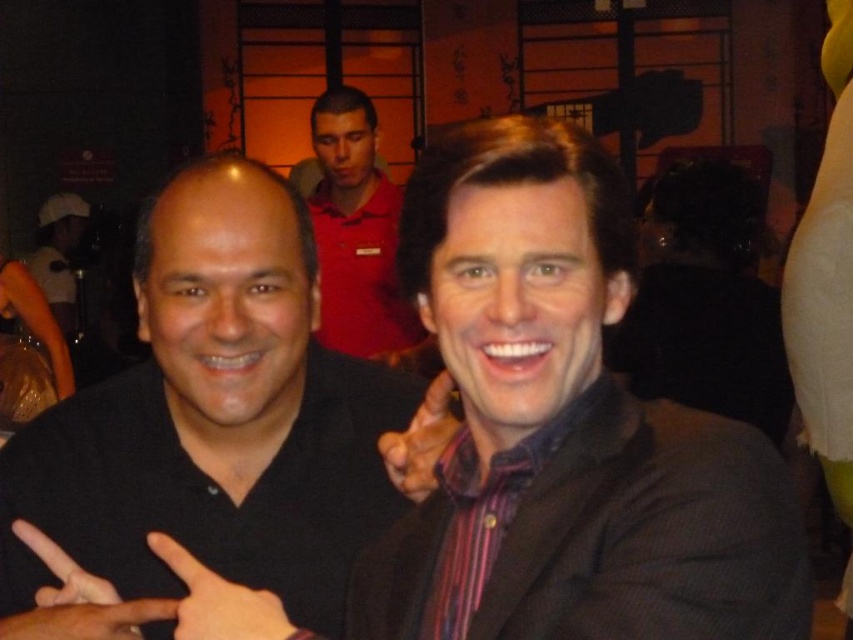
You are a photographer at the event and want to ensure the matte red polo shirt at center is visible in the final photo. Is the black matte hand at lower left blocking it?

The matte red polo shirt at center is located above the black matte hand at lower left, so the hand is not blocking the shirt.